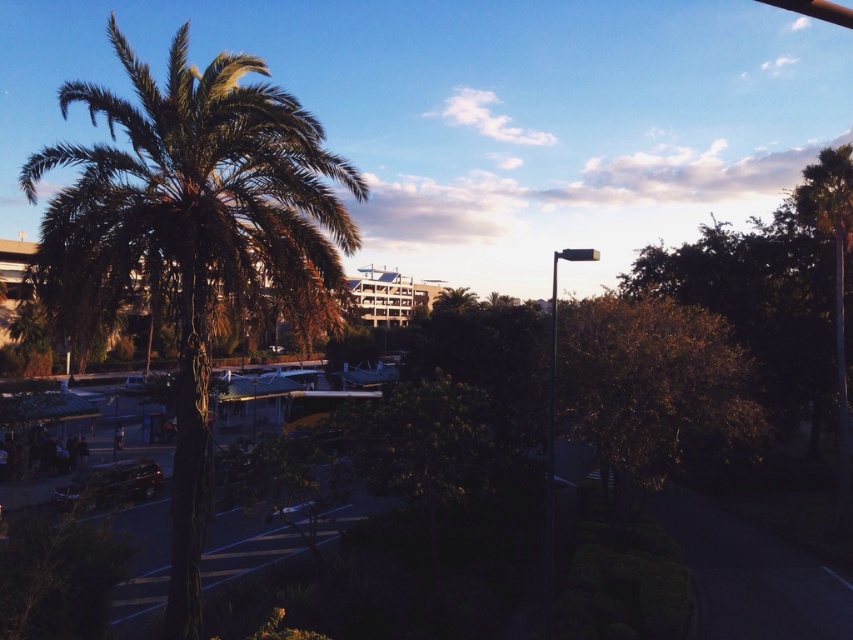
Question: Is green leafy palm tree at left wider than shiny dark brown car at lower left?

Choices:
 (A) no
 (B) yes

Answer: (B)

Question: Which of the following is the closest to the observer?

Choices:
 (A) (103, 474)
 (B) (250, 161)

Answer: (B)

Question: Which of the following is the closest to the observer?

Choices:
 (A) (112, 474)
 (B) (224, 76)

Answer: (B)

Question: Does green leafy palm tree at left have a lesser width compared to shiny dark brown car at lower left?

Choices:
 (A) yes
 (B) no

Answer: (B)

Question: Among these objects, which one is nearest to the camera?

Choices:
 (A) shiny dark brown car at lower left
 (B) green leafy palm tree at left

Answer: (B)

Question: Considering the relative positions of green leafy palm tree at left and shiny dark brown car at lower left in the image provided, where is green leafy palm tree at left located with respect to shiny dark brown car at lower left?

Choices:
 (A) right
 (B) left

Answer: (B)